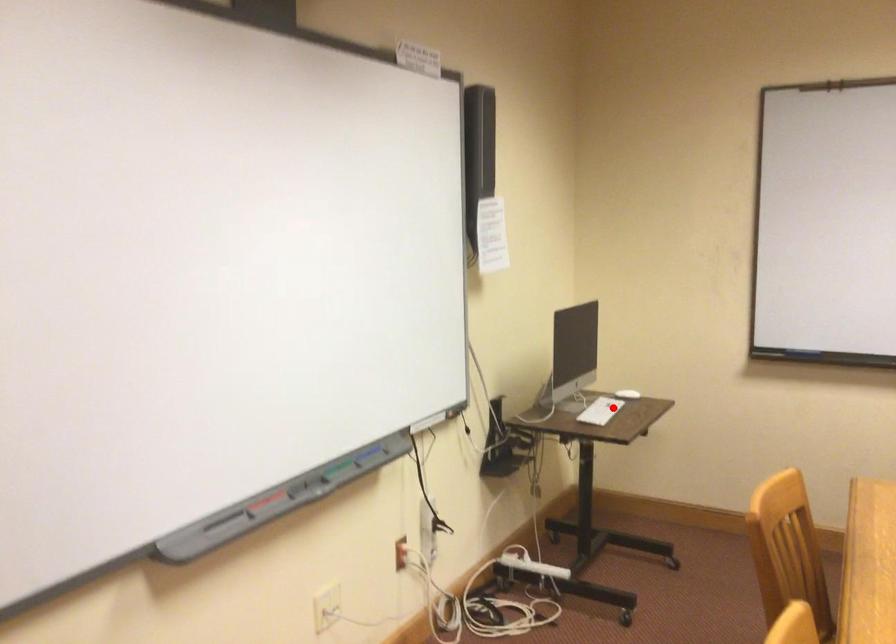
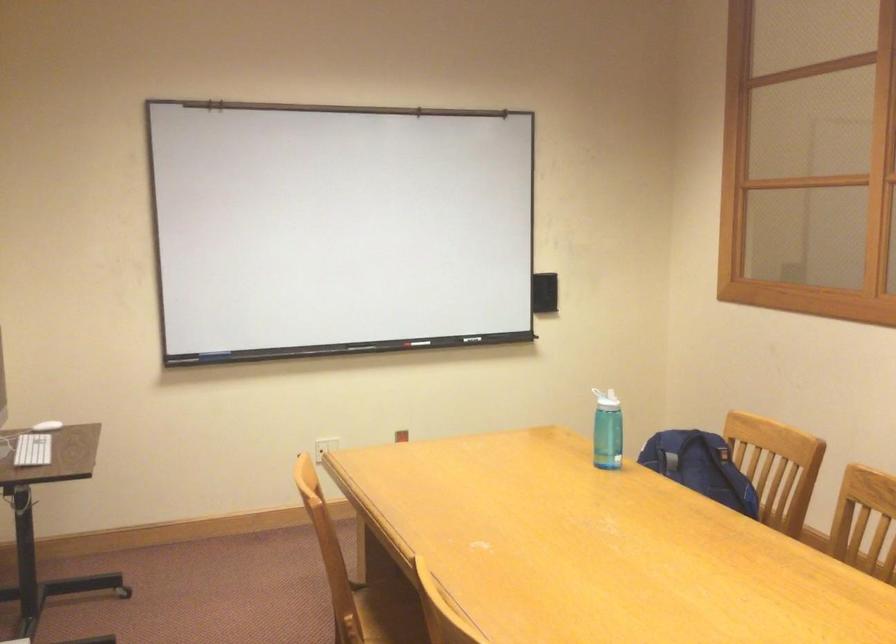
Question: I am providing you with two images of the same scene from different viewpoints. In image1, a red point is highlighted. Considering the same 3D point in image2, which of the following is correct?

Choices:
 (A) It is closer
 (B) It is farther

Answer: (A)